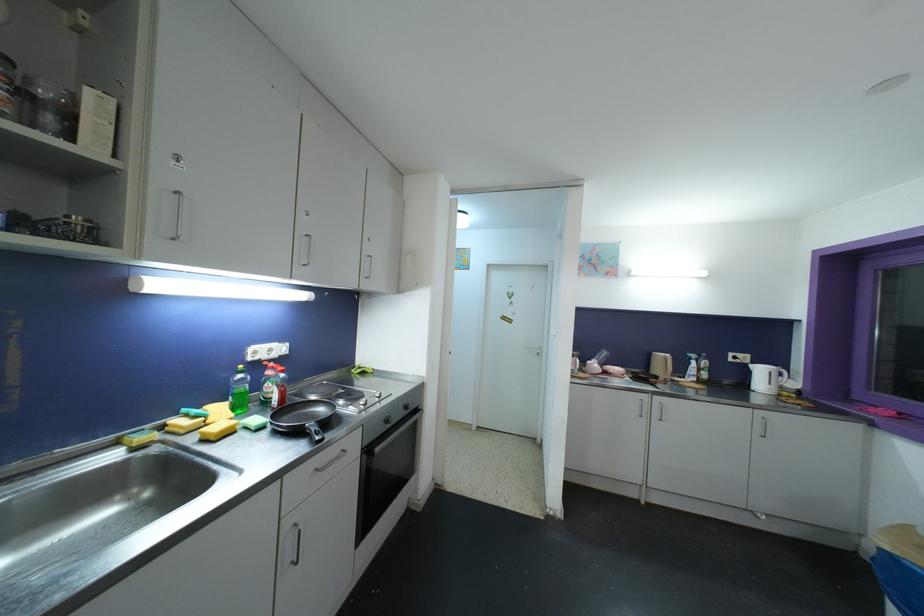
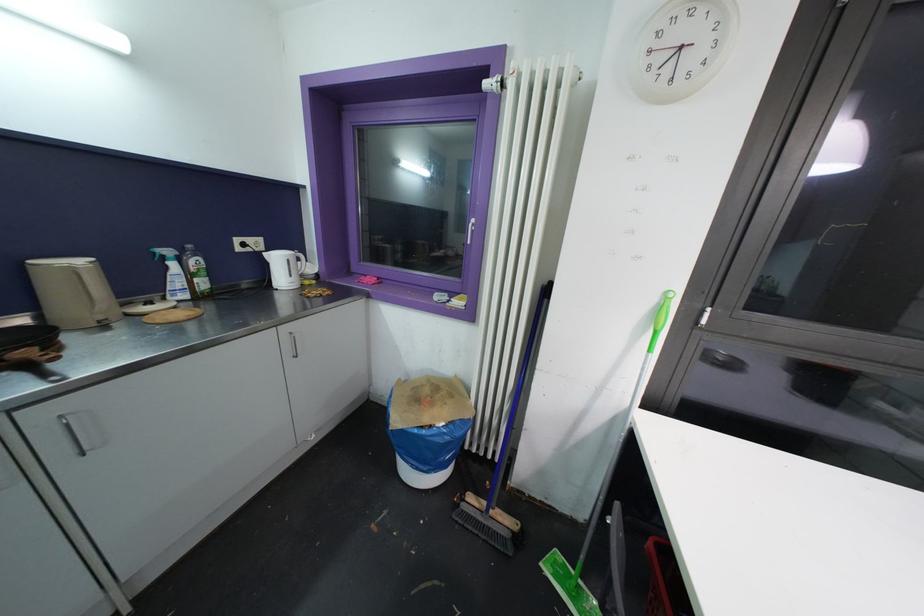
Find the pixel in the second image that matches point 763,373 in the first image.

(281, 262)